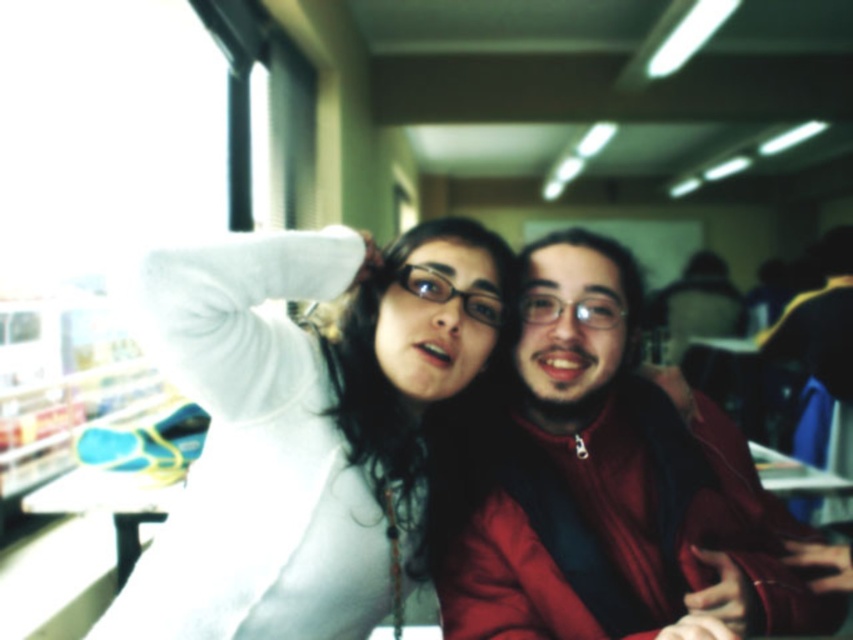
Question: Does white matte sweater at center have a greater width compared to matte red jacket at center?

Choices:
 (A) no
 (B) yes

Answer: (A)

Question: Which point appears closest to the camera in this image?

Choices:
 (A) (281, 392)
 (B) (697, 404)

Answer: (A)

Question: Is white matte sweater at center to the right of matte red jacket at center from the viewer's perspective?

Choices:
 (A) yes
 (B) no

Answer: (B)

Question: Which point is closer to the camera?

Choices:
 (A) matte red jacket at center
 (B) white matte sweater at center

Answer: (A)

Question: Is white matte sweater at center below matte red jacket at center?

Choices:
 (A) yes
 (B) no

Answer: (B)

Question: Which of the following is the farthest from the observer?

Choices:
 (A) (392, 420)
 (B) (553, 579)

Answer: (A)